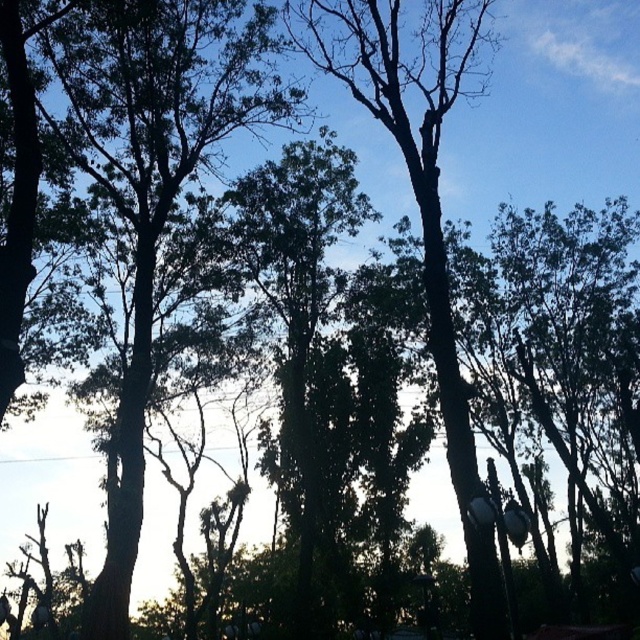
Question: Is dark green leafy tree at upper left further to camera compared to green leafy tree at center?

Choices:
 (A) no
 (B) yes

Answer: (B)

Question: Does dark green leafy tree at upper left come in front of green leafy tree at center?

Choices:
 (A) yes
 (B) no

Answer: (B)

Question: Which object is closer to the camera taking this photo?

Choices:
 (A) green leafy tree at center
 (B) dark green leafy tree at upper left

Answer: (A)

Question: Among these objects, which one is nearest to the camera?

Choices:
 (A) dark green leafy tree at upper left
 (B) green leafy tree at center

Answer: (B)

Question: Which point appears farthest from the camera in this image?

Choices:
 (A) [93, 584]
 (B) [436, 336]

Answer: (A)

Question: Does dark green leafy tree at upper left have a larger size compared to green leafy tree at center?

Choices:
 (A) yes
 (B) no

Answer: (B)